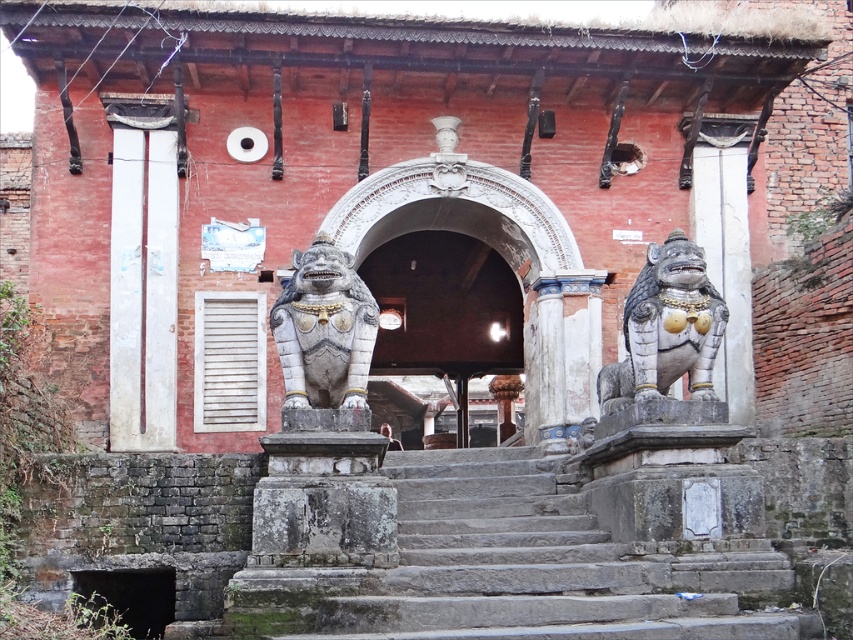
Question: Which point is farther to the camera?

Choices:
 (A) (408, 516)
 (B) (428, 332)

Answer: (B)

Question: Among these points, which one is farthest from the camera?

Choices:
 (A) (x=664, y=253)
 (B) (x=115, y=227)

Answer: (B)

Question: Which point is farther from the camera taking this photo?

Choices:
 (A) (706, 326)
 (B) (311, 381)
 (C) (151, 172)

Answer: (C)

Question: Is gray stone lion at center to the left of white marble statue at center from the viewer's perspective?

Choices:
 (A) yes
 (B) no

Answer: (A)

Question: Does polished stone lion at right appear on the right side of white marble statue at center?

Choices:
 (A) yes
 (B) no

Answer: (B)

Question: Is white painted wood at left further to the viewer compared to polished stone lion at right?

Choices:
 (A) yes
 (B) no

Answer: (A)